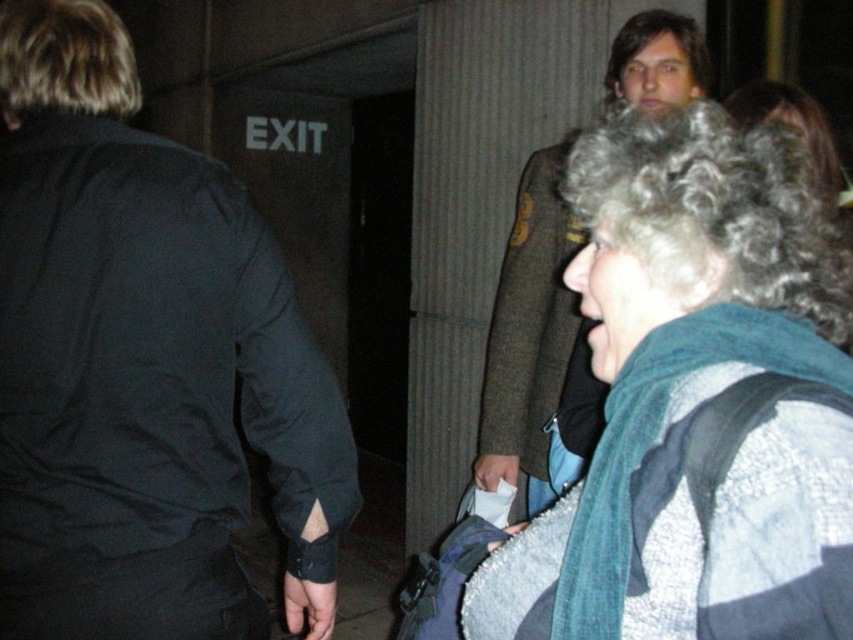
Question: Which point appears farthest from the camera in this image?

Choices:
 (A) (199, 442)
 (B) (850, 312)

Answer: (A)

Question: In this image, where is black matte jacket at upper left located relative to gray wool scarf at upper right?

Choices:
 (A) right
 (B) left

Answer: (B)

Question: Among these points, which one is farthest from the camera?

Choices:
 (A) (138, 230)
 (B) (577, 141)

Answer: (A)

Question: Which point is farther from the camera taking this photo?

Choices:
 (A) (593, 289)
 (B) (283, 436)
 (C) (672, 28)

Answer: (C)

Question: Can you confirm if black matte jacket at upper left is bigger than gray wool scarf at upper right?

Choices:
 (A) yes
 (B) no

Answer: (A)

Question: In this image, where is gray wool scarf at upper right located relative to green wool coat at upper right?

Choices:
 (A) below
 (B) above

Answer: (A)